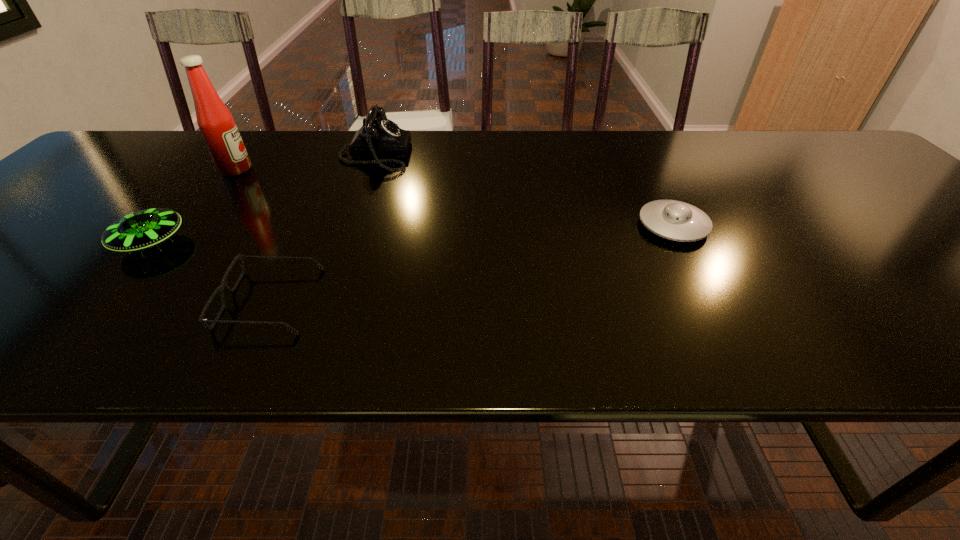
The width and height of the screenshot is (960, 540). In the image, there is a desktop. Find the location of `vacant area at the right edge`. vacant area at the right edge is located at coordinates (957, 244).

Identify the location of free location at the far left corner of the desktop. (160, 141).

Where is `free region at the far right corner of the desktop`? free region at the far right corner of the desktop is located at coordinates (842, 145).

Where is `free area in between the third tallest object and the condiment`? The width and height of the screenshot is (960, 540). free area in between the third tallest object and the condiment is located at coordinates (193, 206).

This screenshot has height=540, width=960. I want to click on unoccupied area between the left saucer and the shorter saucer, so point(412,234).

Identify the location of free space between the spectacles and the telephone. This screenshot has height=540, width=960. (323, 227).

The image size is (960, 540). Find the location of `free point between the rightmost object and the spectacles`. free point between the rightmost object and the spectacles is located at coordinates (471, 263).

Locate an element on the screen. The image size is (960, 540). free area in between the tallest object and the left saucer is located at coordinates (193, 206).

Locate an element on the screen. Image resolution: width=960 pixels, height=540 pixels. empty location between the condiment and the rightmost object is located at coordinates (454, 198).

Locate an element on the screen. The width and height of the screenshot is (960, 540). empty space between the third shortest object and the telephone is located at coordinates (263, 199).